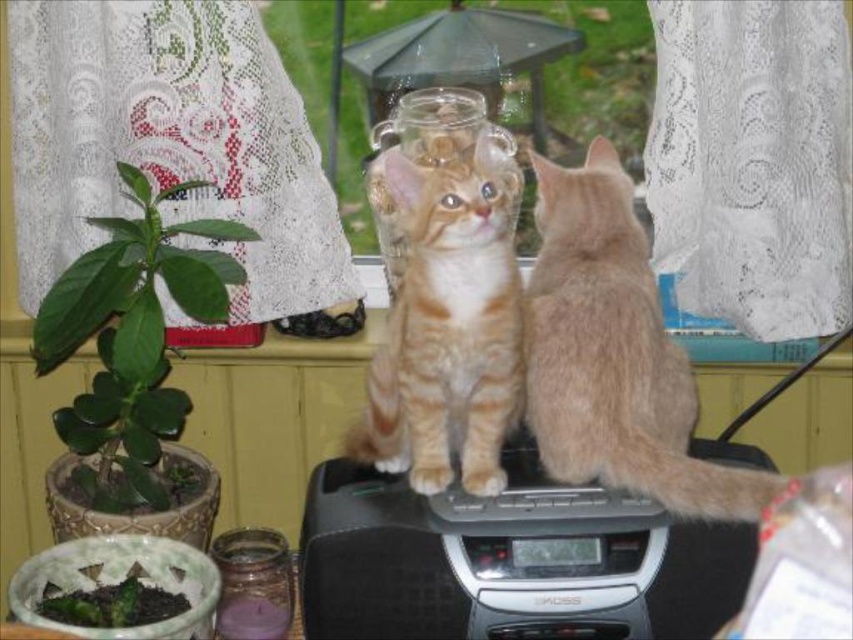
Based on the photo, you are a cat owner who wants to place a small toy between the two kittens. The kittens are sitting on the stereo system at center. The stereo system has a digital display and buttons. Where should you place the toy so it is exactly at the point marked by the coordinates point [494,561] on the black plastic radio at center?

The point marked by the coordinates point [494,561] on the black plastic radio at center is the exact location where you should place the toy.

You are standing in the room and want to turn on the black plastic radio at center. If your hand can reach up to 3 feet, can you reach the radio?

The black plastic radio at center is 3.36 feet away from the viewer. Since your hand can reach up to 3 feet, you cannot reach the radio as it is slightly farther than your reach.